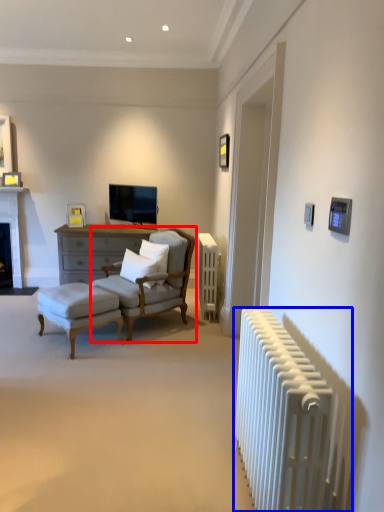
Question: Which object is closer to the camera taking this photo, chair (highlighted by a red box) or radiator (highlighted by a blue box)?

Choices:
 (A) chair
 (B) radiator

Answer: (B)